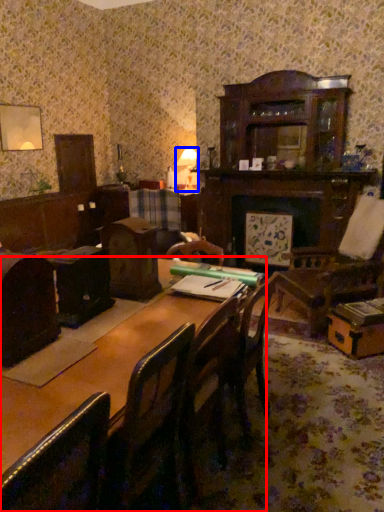
Question: Which object is further to the camera taking this photo, table (highlighted by a red box) or table lamp (highlighted by a blue box)?

Choices:
 (A) table
 (B) table lamp

Answer: (B)